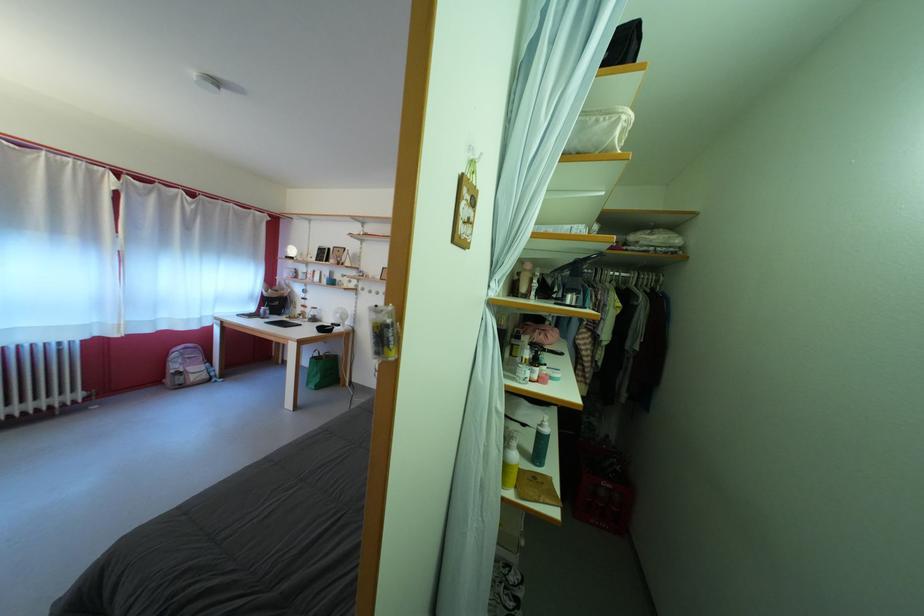
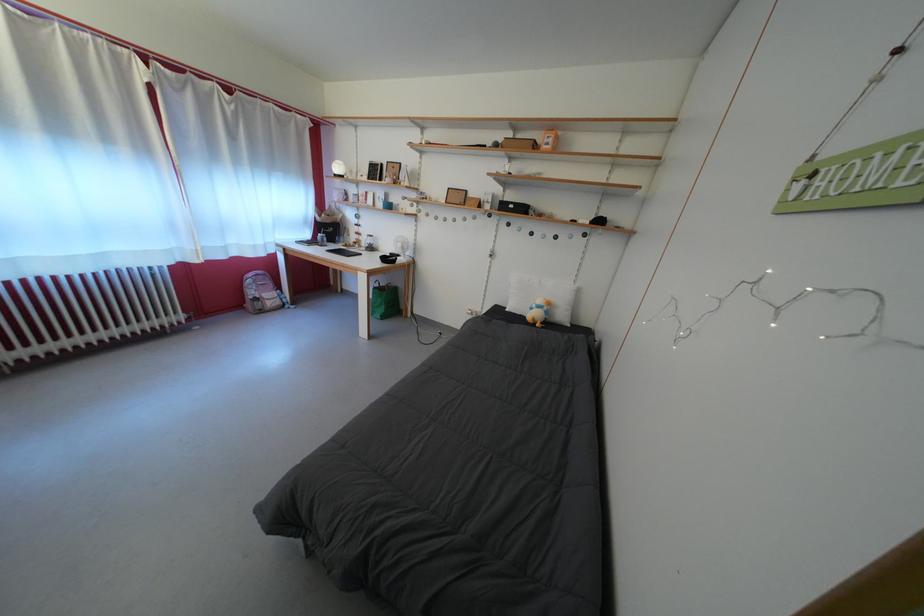
The point at (322,363) is marked in the first image. Where is the corresponding point in the second image?

(383, 294)